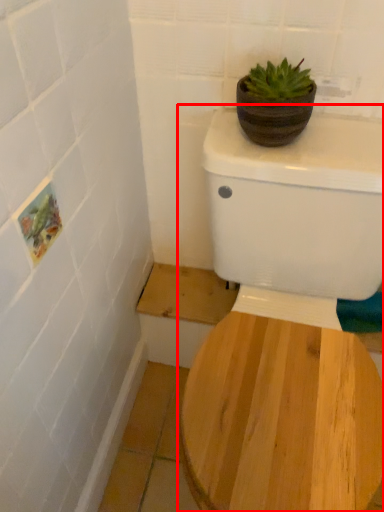
Question: From the image's perspective, considering the relative positions of toilet (annotated by the red box) and flowerpot in the image provided, where is toilet (annotated by the red box) located with respect to the staircase?

Choices:
 (A) below
 (B) above

Answer: (A)